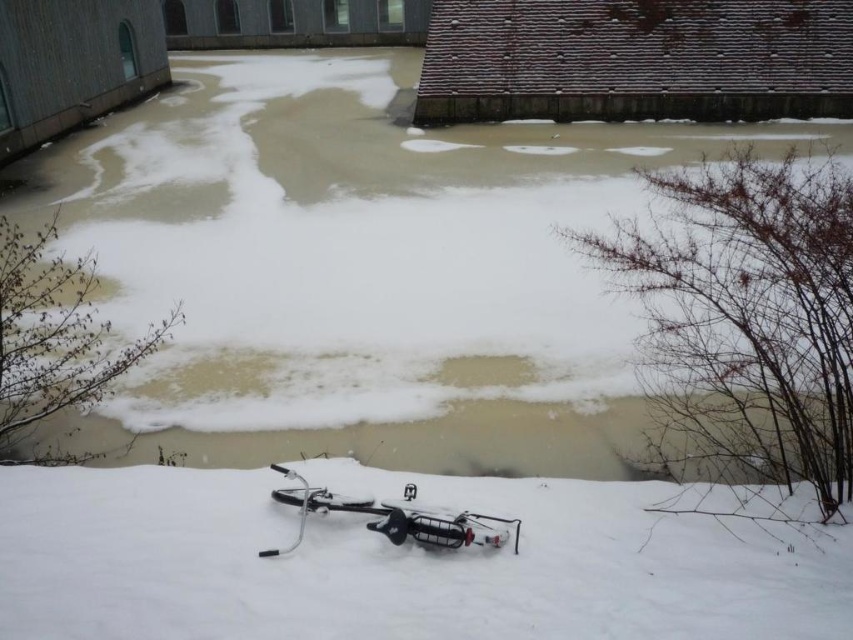
Question: Among these points, which one is farthest from the camera?

Choices:
 (A) (271, 554)
 (B) (624, 413)
 (C) (610, 573)

Answer: (B)

Question: Is white fluffy snow at bottom wider than silver metallic bicycle at lower center?

Choices:
 (A) no
 (B) yes

Answer: (B)

Question: Which point is closer to the camera taking this photo?

Choices:
 (A) (289, 520)
 (B) (296, 305)
 (C) (306, 490)

Answer: (A)

Question: Observing the image, what is the correct spatial positioning of white fluffy snow at bottom in reference to silver metallic bicycle at lower center?

Choices:
 (A) right
 (B) left

Answer: (A)

Question: Among these objects, which one is farthest from the camera?

Choices:
 (A) silver metallic bicycle at lower center
 (B) white frothy water at center

Answer: (B)

Question: Can you confirm if white frothy water at center is positioned to the right of silver metallic bicycle at lower center?

Choices:
 (A) no
 (B) yes

Answer: (B)